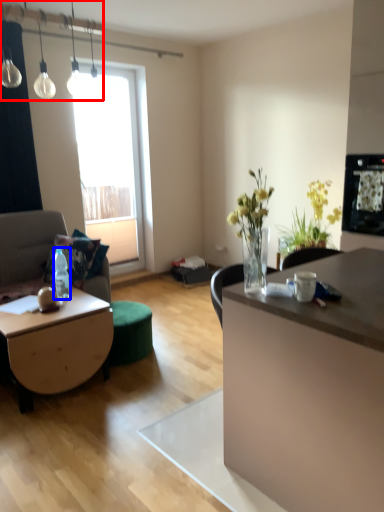
Question: Which object is further to the camera taking this photo, lamp (highlighted by a red box) or bottle (highlighted by a blue box)?

Choices:
 (A) lamp
 (B) bottle

Answer: (B)